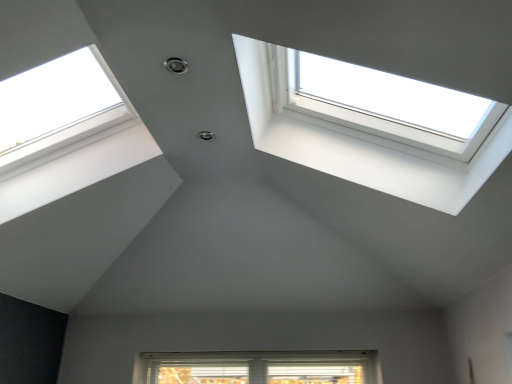
What do you see at coordinates (76, 149) in the screenshot? I see `white plastic window at upper left, which is counted as the 1th window, starting from the left` at bounding box center [76, 149].

What is the approximate width of white plastic window at upper left, which is counted as the 1th window, starting from the left?

31.91 inches.

From the picture: What is the approximate height of white plastic window at upper left, which is counted as the 1th window, starting from the left?

The height of white plastic window at upper left, which is counted as the 1th window, starting from the left, is 46.85 centimeters.

You are a GUI agent. You are given a task and a screenshot of the screen. Output one action in this format:
    pyautogui.click(x=<x>, y=<y>)
    Task: Click on the white plastic window at upper left, the 2th window when ordered from right to left
    This screenshot has width=512, height=384.
    Given the screenshot: What is the action you would take?
    pyautogui.click(x=76, y=149)

The image size is (512, 384). Identify the location of white plastic window at upper right, positioned as the second window in left-to-right order. (362, 137).

Describe the element at coordinates (362, 137) in the screenshot. I see `white plastic window at upper right, which is the 1th window from right to left` at that location.

Identify the location of white plastic window at upper left, the 2th window when ordered from right to left. The image size is (512, 384). click(x=76, y=149).

Between white plastic window at upper left, which is counted as the 1th window, starting from the left, and white plastic window at upper right, which is the 1th window from right to left, which one appears on the right side from the viewer's perspective?

white plastic window at upper right, which is the 1th window from right to left.

Is white plastic window at upper left, which is counted as the 1th window, starting from the left, positioned behind white plastic window at upper right, positioned as the second window in left-to-right order?

Yes.

Considering the points (95, 115) and (338, 174), which point is in front, point (95, 115) or point (338, 174)?

Positioned in front is point (338, 174).

From the image's perspective, does white plastic window at upper left, which is counted as the 1th window, starting from the left, appear higher than white plastic window at upper right, which is the 1th window from right to left?

No, from the image's perspective, white plastic window at upper left, which is counted as the 1th window, starting from the left, is not on top of white plastic window at upper right, which is the 1th window from right to left.

From a real-world perspective, between white plastic window at upper left, which is counted as the 1th window, starting from the left, and white plastic window at upper right, positioned as the second window in left-to-right order, who is vertically lower?

From a 3D spatial view, white plastic window at upper left, which is counted as the 1th window, starting from the left, is below.

Between white plastic window at upper left, the 2th window when ordered from right to left, and white plastic window at upper right, which is the 1th window from right to left, which one has larger width?

With larger width is white plastic window at upper right, which is the 1th window from right to left.

Does white plastic window at upper left, which is counted as the 1th window, starting from the left, have a lesser height compared to white plastic window at upper right, positioned as the second window in left-to-right order?

No, white plastic window at upper left, which is counted as the 1th window, starting from the left, is not shorter than white plastic window at upper right, positioned as the second window in left-to-right order.

Based on their sizes in the image, would you say white plastic window at upper left, which is counted as the 1th window, starting from the left, is bigger or smaller than white plastic window at upper right, positioned as the second window in left-to-right order?

Clearly, white plastic window at upper left, which is counted as the 1th window, starting from the left, is smaller in size than white plastic window at upper right, positioned as the second window in left-to-right order.

In the scene shown: Would you say white plastic window at upper left, the 2th window when ordered from right to left, contains white plastic window at upper right, positioned as the second window in left-to-right order?

Actually, white plastic window at upper right, positioned as the second window in left-to-right order, is outside white plastic window at upper left, the 2th window when ordered from right to left.

Is white plastic window at upper left, the 2th window when ordered from right to left, touching white plastic window at upper right, which is the 1th window from right to left?

There is a gap between white plastic window at upper left, the 2th window when ordered from right to left, and white plastic window at upper right, which is the 1th window from right to left.

Could you tell me if white plastic window at upper left, which is counted as the 1th window, starting from the left, is turned towards white plastic window at upper right, positioned as the second window in left-to-right order?

Yes, white plastic window at upper left, which is counted as the 1th window, starting from the left, is facing white plastic window at upper right, positioned as the second window in left-to-right order.

This screenshot has width=512, height=384. Identify the location of window behind the white plastic window at upper right, which is the 1th window from right to left. (76, 149).

Which object is positioned more to the right, white plastic window at upper right, which is the 1th window from right to left, or white plastic window at upper left, the 2th window when ordered from right to left?

white plastic window at upper right, which is the 1th window from right to left.

Does white plastic window at upper right, positioned as the second window in left-to-right order, come in front of white plastic window at upper left, the 2th window when ordered from right to left?

That is True.

Does point (435, 162) come closer to viewer compared to point (119, 129)?

Yes.

From the image's perspective, does white plastic window at upper right, which is the 1th window from right to left, appear lower than white plastic window at upper left, the 2th window when ordered from right to left?

No, from the image's perspective, white plastic window at upper right, which is the 1th window from right to left, is not beneath white plastic window at upper left, the 2th window when ordered from right to left.

From a real-world perspective, does white plastic window at upper right, which is the 1th window from right to left, sit lower than white plastic window at upper left, the 2th window when ordered from right to left?

Incorrect, from a real-world perspective, white plastic window at upper right, which is the 1th window from right to left, is higher than white plastic window at upper left, the 2th window when ordered from right to left.

Looking at this image, between white plastic window at upper right, positioned as the second window in left-to-right order, and white plastic window at upper left, the 2th window when ordered from right to left, which one has larger width?

white plastic window at upper right, positioned as the second window in left-to-right order.

Consider the image. Is white plastic window at upper right, positioned as the second window in left-to-right order, taller than white plastic window at upper left, which is counted as the 1th window, starting from the left?

No.

Considering the relative sizes of white plastic window at upper right, positioned as the second window in left-to-right order, and white plastic window at upper left, the 2th window when ordered from right to left, in the image provided, is white plastic window at upper right, positioned as the second window in left-to-right order, smaller than white plastic window at upper left, the 2th window when ordered from right to left,?

No, white plastic window at upper right, positioned as the second window in left-to-right order, is not smaller than white plastic window at upper left, the 2th window when ordered from right to left.

Is white plastic window at upper right, positioned as the second window in left-to-right order, outside of white plastic window at upper left, the 2th window when ordered from right to left?

white plastic window at upper right, positioned as the second window in left-to-right order, is positioned outside white plastic window at upper left, the 2th window when ordered from right to left.

Are white plastic window at upper right, which is the 1th window from right to left, and white plastic window at upper left, the 2th window when ordered from right to left, located far from each other?

white plastic window at upper right, which is the 1th window from right to left, is near white plastic window at upper left, the 2th window when ordered from right to left, not far away.

Is white plastic window at upper right, positioned as the second window in left-to-right order, facing away from white plastic window at upper left, which is counted as the 1th window, starting from the left?

No, white plastic window at upper right, positioned as the second window in left-to-right order,'s orientation is not away from white plastic window at upper left, which is counted as the 1th window, starting from the left.

What's the angular difference between white plastic window at upper right, which is the 1th window from right to left, and white plastic window at upper left, which is counted as the 1th window, starting from the left,'s facing directions?

They differ by 180 degrees in their facing directions.

How much distance is there between white plastic window at upper right, positioned as the second window in left-to-right order, and white plastic window at upper left, the 2th window when ordered from right to left?

white plastic window at upper right, positioned as the second window in left-to-right order, and white plastic window at upper left, the 2th window when ordered from right to left, are 38.06 inches apart.

Where is `window located in front of the white plastic window at upper left, the 2th window when ordered from right to left`? Image resolution: width=512 pixels, height=384 pixels. window located in front of the white plastic window at upper left, the 2th window when ordered from right to left is located at coordinates (362, 137).

The image size is (512, 384). What are the coordinates of `window below the white plastic window at upper right, which is the 1th window from right to left (from a real-world perspective)` in the screenshot? It's located at (76, 149).

At what (x,y) coordinates should I click in order to perform the action: click on window lying in front of the white plastic window at upper left, the 2th window when ordered from right to left. Please return your answer as a coordinate pair (x, y). Image resolution: width=512 pixels, height=384 pixels. Looking at the image, I should click on (362, 137).